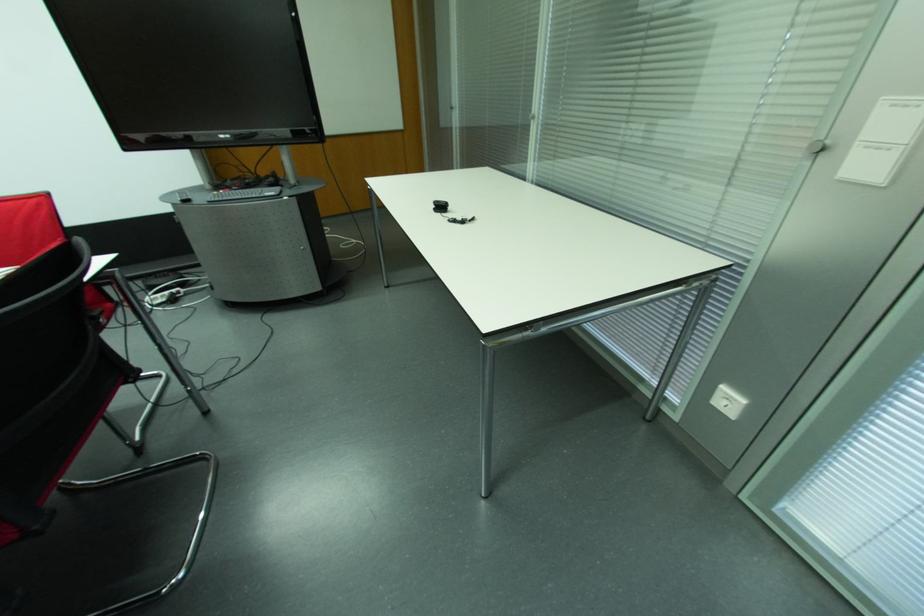
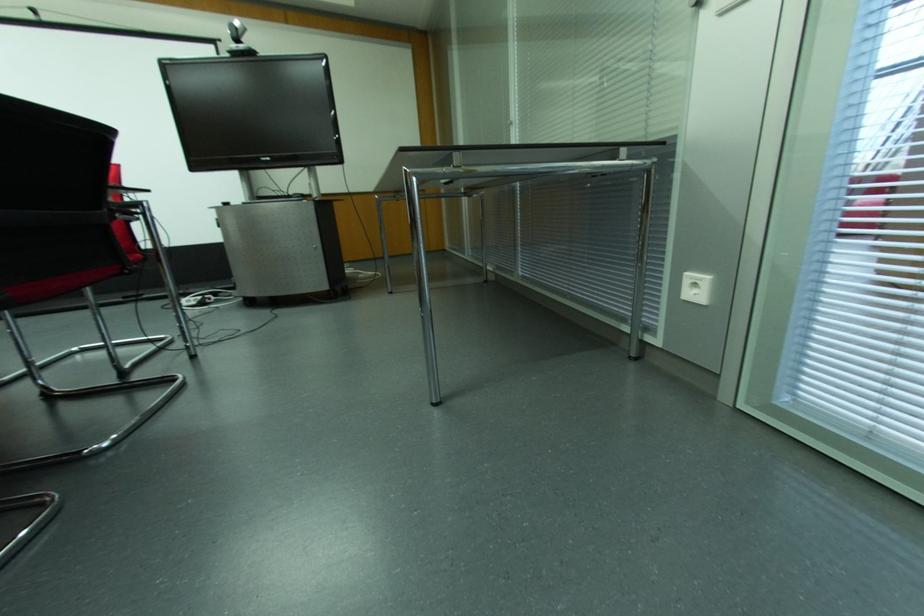
Where in the second image is the point corresponding to [724,402] from the first image?

(694, 291)